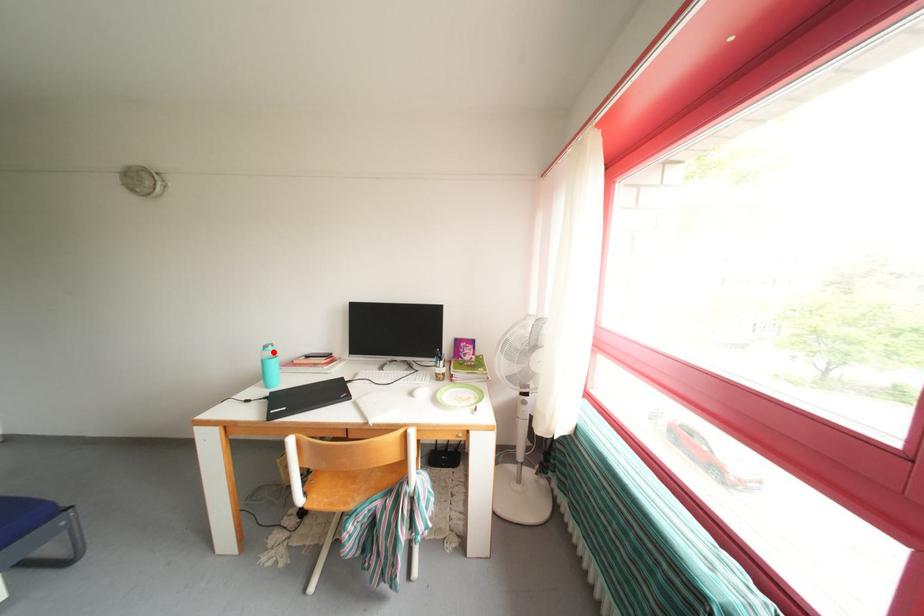
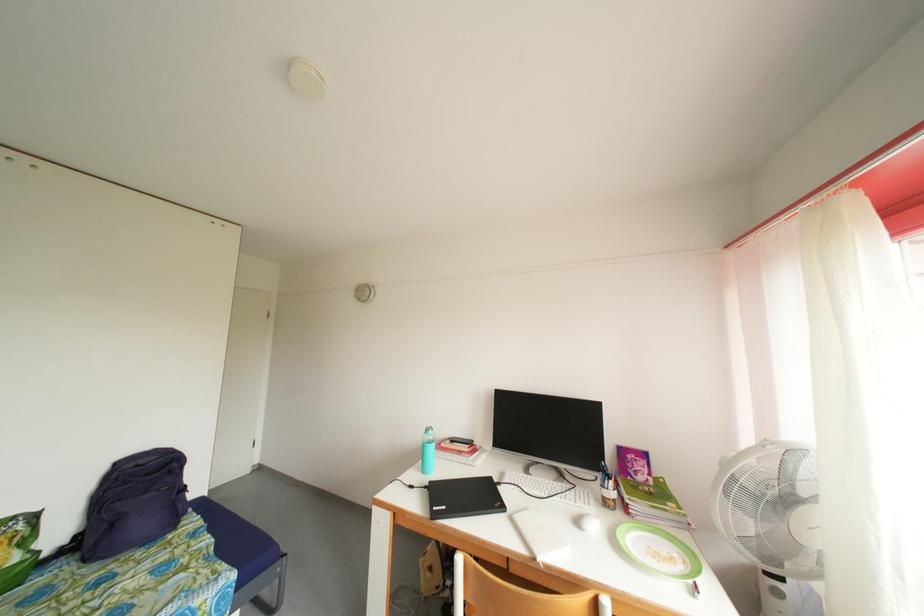
Question: A red point is marked in image1. In image2, is the corresponding 3D point closer to the camera or farther? Reply with the corresponding letter.

Choices:
 (A) The corresponding 3D point is closer.
 (B) The corresponding 3D point is farther.

Answer: (B)